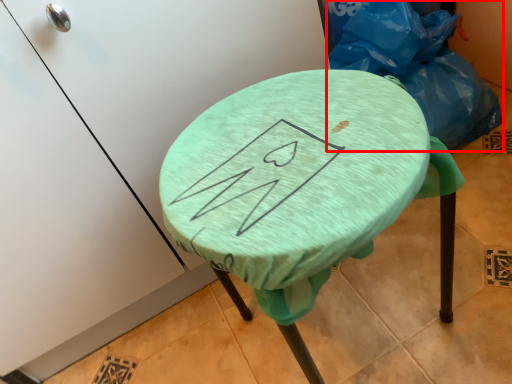
Question: From the image, what is the correct spatial relationship of garbage (annotated by the red box) in relation to furniture?

Choices:
 (A) left
 (B) right

Answer: (B)